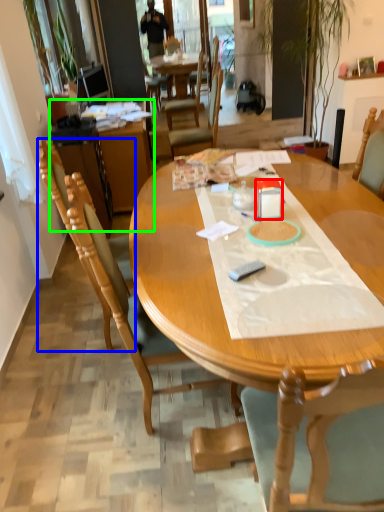
Question: Considering the real-world distances, which object is farthest from box (highlighted by a red box)? chair (highlighted by a blue box) or computer desk (highlighted by a green box)?

Choices:
 (A) chair
 (B) computer desk

Answer: (B)